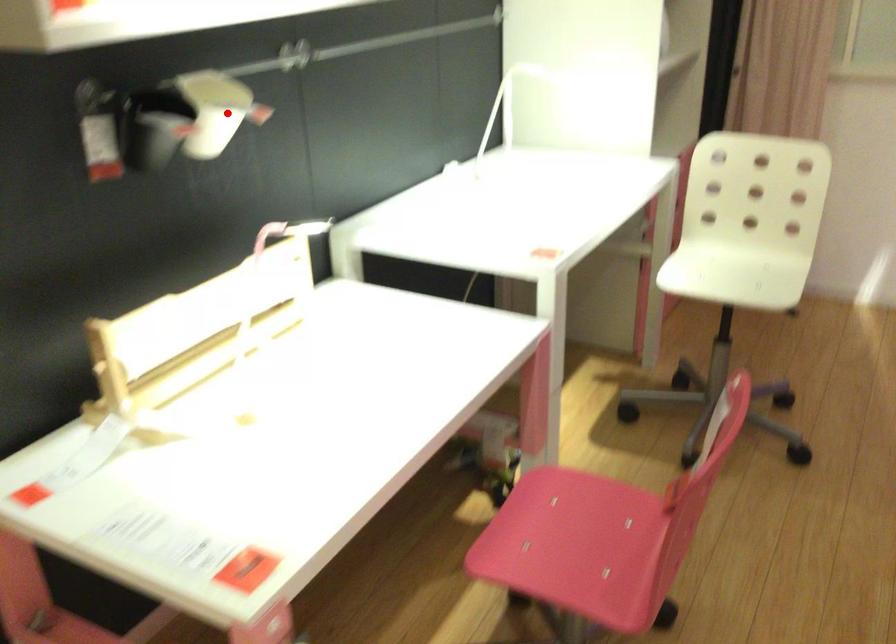
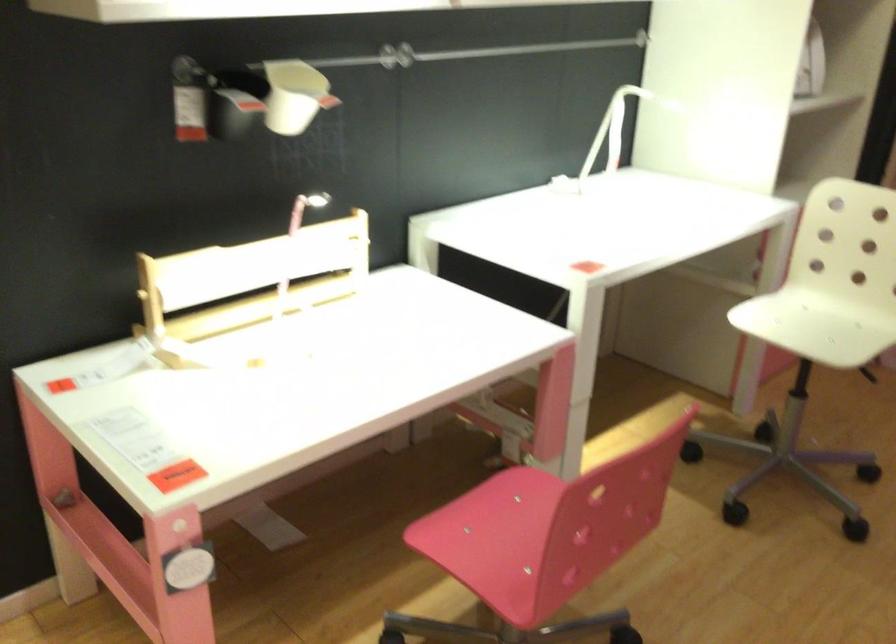
Question: I am providing you with two images of the same scene from different viewpoints. Given a red point in image1, look at the same physical point in image2. Is it:

Choices:
 (A) Closer to the viewpoint
 (B) Farther from the viewpoint

Answer: (B)